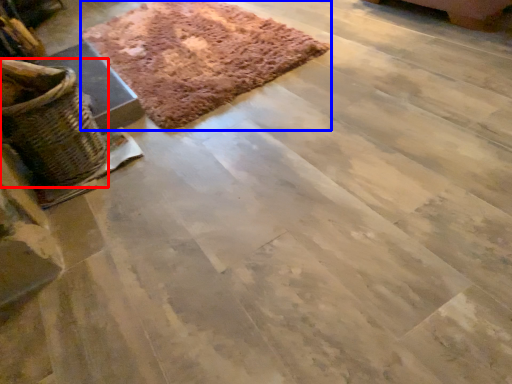
Question: Which object is further to the camera taking this photo, basket (highlighted by a red box) or mat (highlighted by a blue box)?

Choices:
 (A) basket
 (B) mat

Answer: (B)